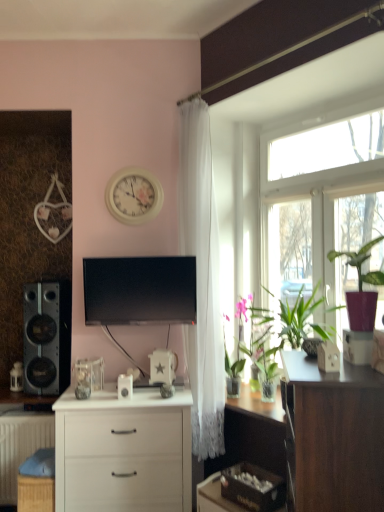
Question: From the image's perspective, is white matte radiator at lower left below white sheer curtain at upper center?

Choices:
 (A) yes
 (B) no

Answer: (A)

Question: From a real-world perspective, is white matte radiator at lower left located beneath white sheer curtain at upper center?

Choices:
 (A) yes
 (B) no

Answer: (A)

Question: Does white matte radiator at lower left contain white sheer curtain at upper center?

Choices:
 (A) yes
 (B) no

Answer: (B)

Question: From the image's perspective, would you say white matte radiator at lower left is positioned over white sheer curtain at upper center?

Choices:
 (A) yes
 (B) no

Answer: (B)

Question: Can you confirm if white matte radiator at lower left is taller than white sheer curtain at upper center?

Choices:
 (A) no
 (B) yes

Answer: (A)

Question: Can you confirm if white matte radiator at lower left is bigger than white sheer curtain at upper center?

Choices:
 (A) no
 (B) yes

Answer: (B)

Question: Is black glossy tv at center facing away from matte black speaker at left?

Choices:
 (A) no
 (B) yes

Answer: (A)

Question: Is black glossy tv at center positioned in front of matte black speaker at left?

Choices:
 (A) yes
 (B) no

Answer: (A)

Question: Can you confirm if black glossy tv at center is positioned to the right of matte black speaker at left?

Choices:
 (A) no
 (B) yes

Answer: (B)

Question: Can you confirm if black glossy tv at center is wider than matte black speaker at left?

Choices:
 (A) no
 (B) yes

Answer: (A)

Question: Is black glossy tv at center bigger than matte black speaker at left?

Choices:
 (A) no
 (B) yes

Answer: (A)

Question: Can you confirm if black glossy tv at center is shorter than matte black speaker at left?

Choices:
 (A) yes
 (B) no

Answer: (A)

Question: Considering the relative positions of matte purple pot at right and black glossy tv at center in the image provided, is matte purple pot at right to the left of black glossy tv at center from the viewer's perspective?

Choices:
 (A) no
 (B) yes

Answer: (A)